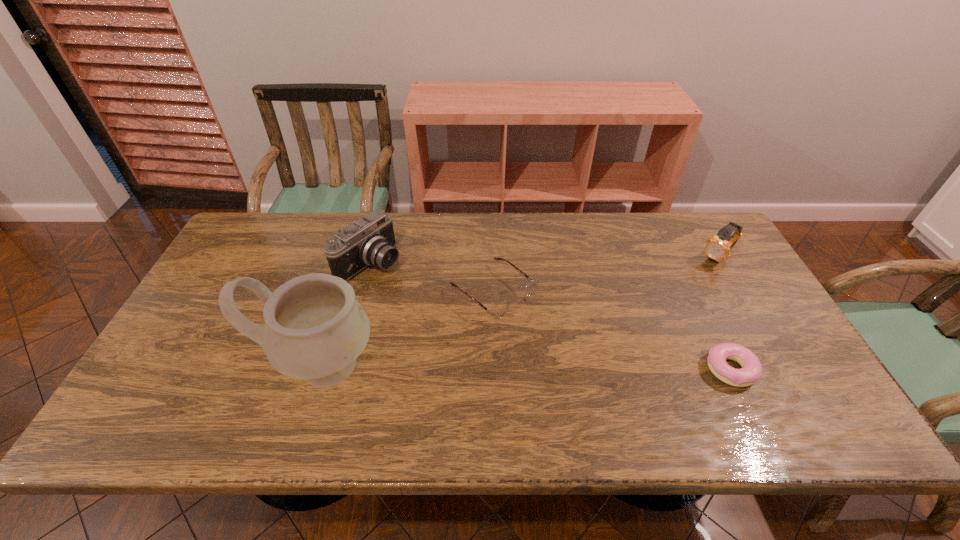
You are a GUI agent. You are given a task and a screenshot of the screen. Output one action in this format:
    pyautogui.click(x=<x>, y=<y>)
    Task: Click on the tallest object
    Image resolution: width=960 pixels, height=540 pixels.
    Given the screenshot: What is the action you would take?
    pyautogui.click(x=315, y=329)

This screenshot has width=960, height=540. I want to click on the shortest object, so click(x=751, y=371).

Where is `the fourth object from left to right`? This screenshot has height=540, width=960. the fourth object from left to right is located at coordinates (751, 371).

Locate an element on the screen. watch is located at coordinates (718, 247).

This screenshot has width=960, height=540. Identify the location of the rightmost object. (718, 247).

Identify the location of the second shortest object. (499, 310).

Find the location of a particular element. The height and width of the screenshot is (540, 960). spectacles is located at coordinates (499, 310).

At what (x,y) coordinates should I click in order to perform the action: click on camera. Please return your answer as a coordinate pair (x, y). This screenshot has width=960, height=540. Looking at the image, I should click on (370, 241).

At what (x,y) coordinates should I click in order to perform the action: click on vacant region located on the left of the tallest object. Please return your answer as a coordinate pair (x, y). Image resolution: width=960 pixels, height=540 pixels. Looking at the image, I should click on pyautogui.click(x=204, y=366).

Where is `vacant space located 0.400m on the back of the second object from right to left`? vacant space located 0.400m on the back of the second object from right to left is located at coordinates (671, 248).